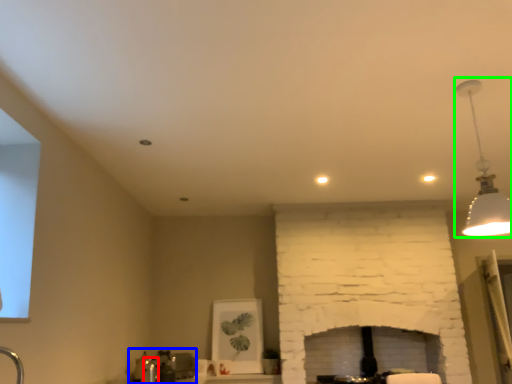
Question: Which object is the closest to the faucet (highlighted by a red box)? Choose among these: sink (highlighted by a blue box) or lamp (highlighted by a green box).

Choices:
 (A) sink
 (B) lamp

Answer: (A)